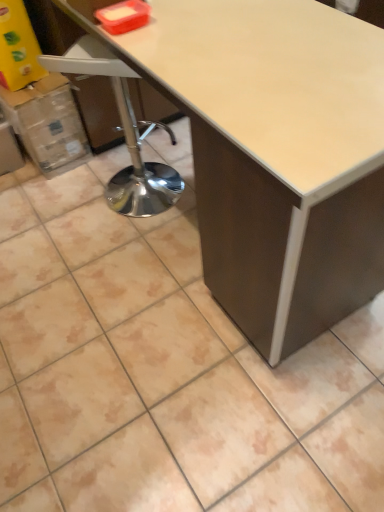
Where is `free space in front of cardboard box at left`? The width and height of the screenshot is (384, 512). free space in front of cardboard box at left is located at coordinates (46, 192).